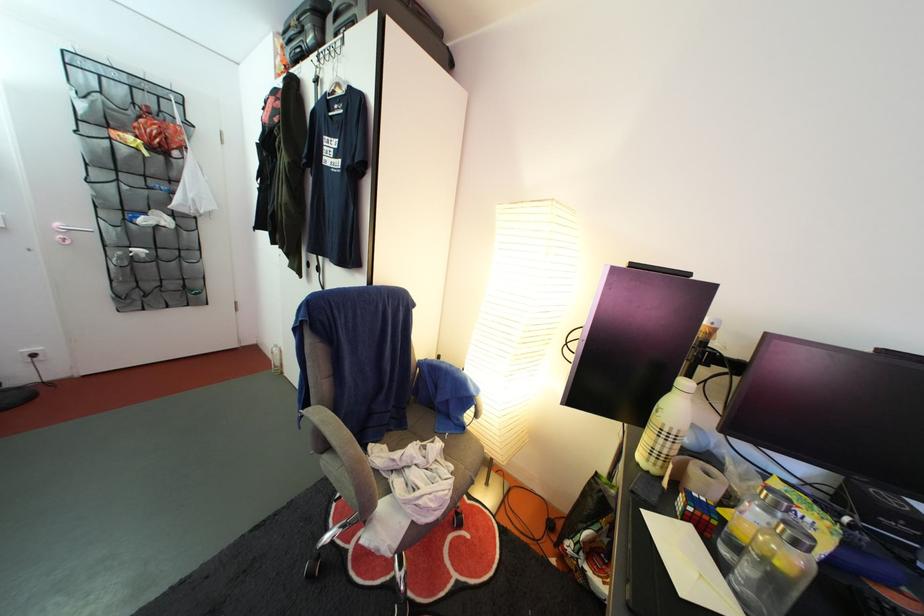
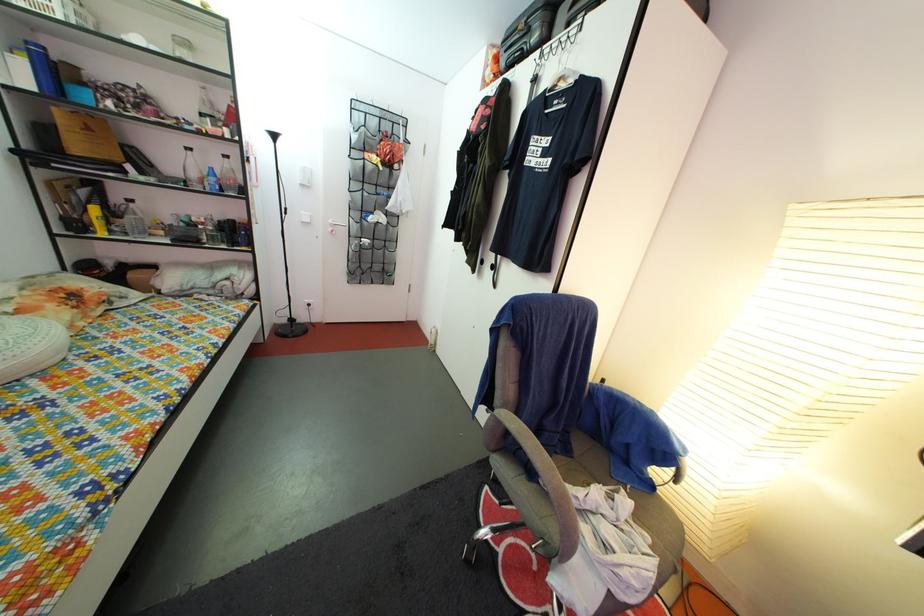
The point at (x=321, y=408) is marked in the first image. Where is the corresponding point in the second image?

(505, 410)